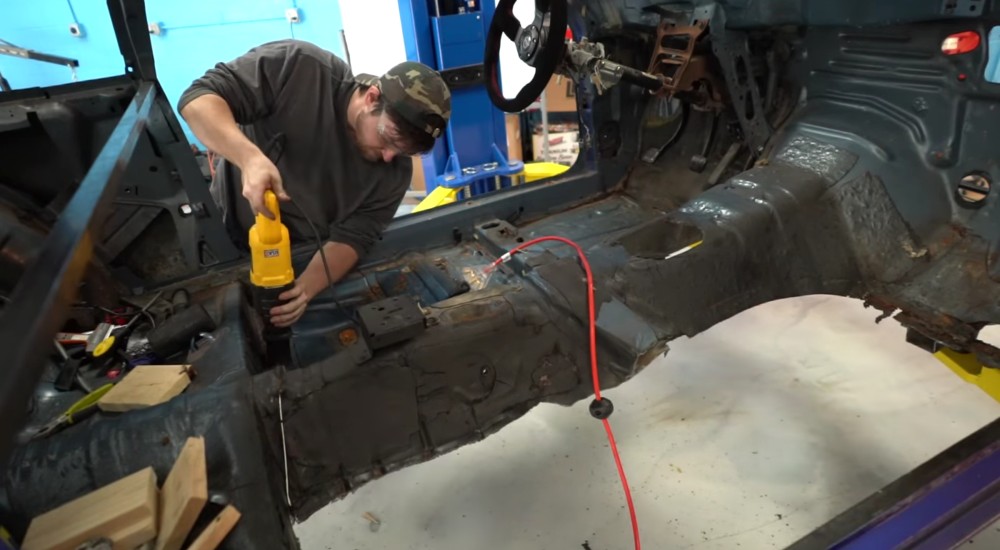
Identify the location of cord. (713, 64), (284, 467).